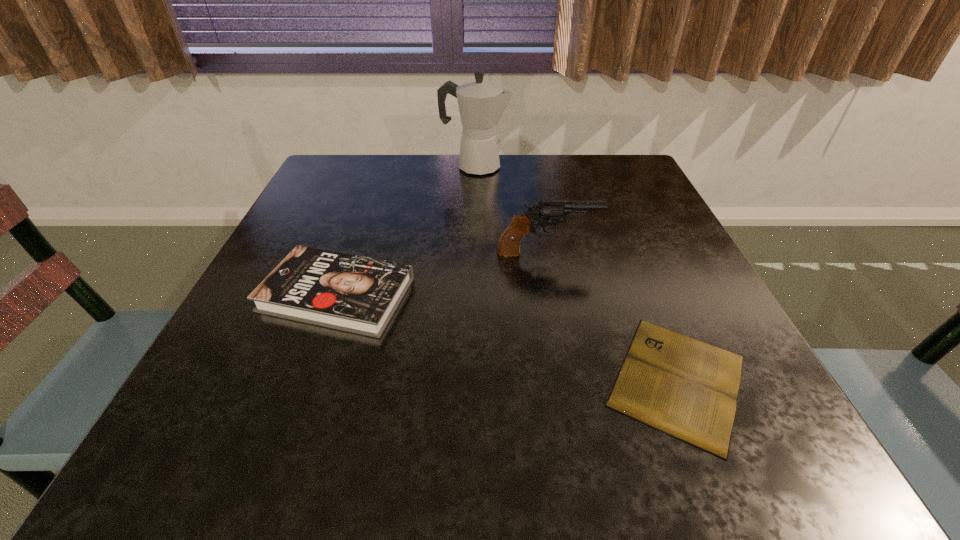
At what (x,y) coordinates should I click in order to perform the action: click on the tallest object. Please return your answer as a coordinate pair (x, y). Looking at the image, I should click on (481, 104).

Where is `coffeepot`? coffeepot is located at coordinates (481, 104).

Identify the location of gun. (546, 212).

Identify the location of the third nearest object. (546, 212).

Image resolution: width=960 pixels, height=540 pixels. Find the location of `the left book`. the left book is located at coordinates (352, 293).

Identify the location of the second shortest object. The height and width of the screenshot is (540, 960). (352, 293).

You are a GUI agent. You are given a task and a screenshot of the screen. Output one action in this format:
    pyautogui.click(x=<x>, y=<y>)
    Task: Click on the shortest object
    The height and width of the screenshot is (540, 960).
    Given the screenshot: What is the action you would take?
    (686, 388)

This screenshot has width=960, height=540. Find the location of `the right book`. the right book is located at coordinates [x=686, y=388].

Locate an element on the screen. vacant area situated on the right of the farthest object is located at coordinates tap(574, 166).

Identify the location of vacant space positioned 0.060m along the barrel of the gun. (627, 253).